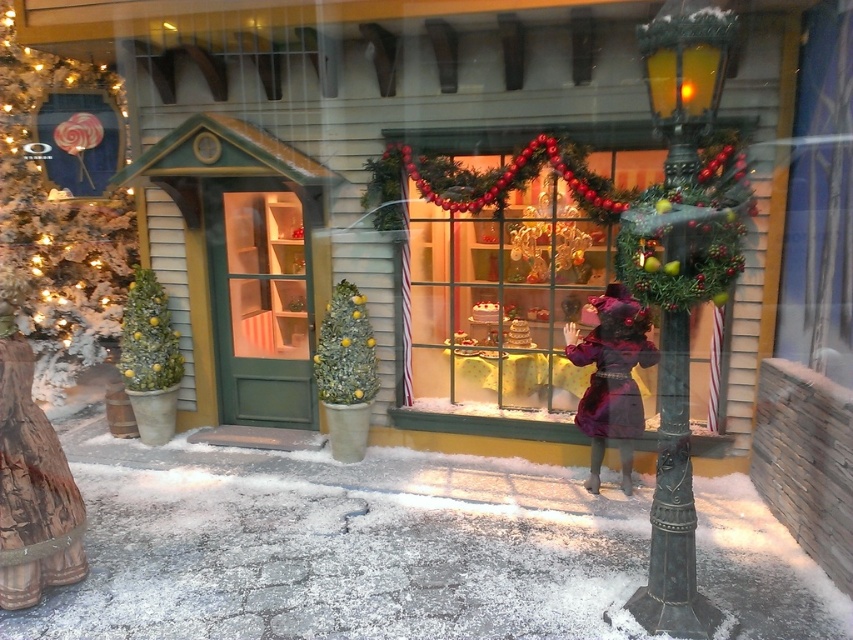
What are the coordinates of the shiny glass window at center?

The shiny glass window at center is located at coordinates point (552,273).

You are standing outside the festive holiday scene, looking at the shiny glass window at center. If you want to touch the window, how many steps do you need to take? Assume each step covers 0.75 meters.

The shiny glass window at center is 5.12 meters away from the viewer. Since each step covers 0.75 meters, you would need to take approximately 7 steps to reach the window. However, since 5.12 divided by 0.75 is approximately 6.826, rounding up gives 7 steps. But since you can only take whole steps, you would need 7 steps to reach the window.

You are standing in front of the festive holiday scene. You want to place a 10 feet long decorative banner between the shiny glass window at center and the green matte christmas tree at left. Is there enough space to stretch the banner between them without folding it?

The distance between the shiny glass window at center and the green matte christmas tree at left is 8.53 feet. Since the banner is 10 feet long, which is longer than the available space, it won